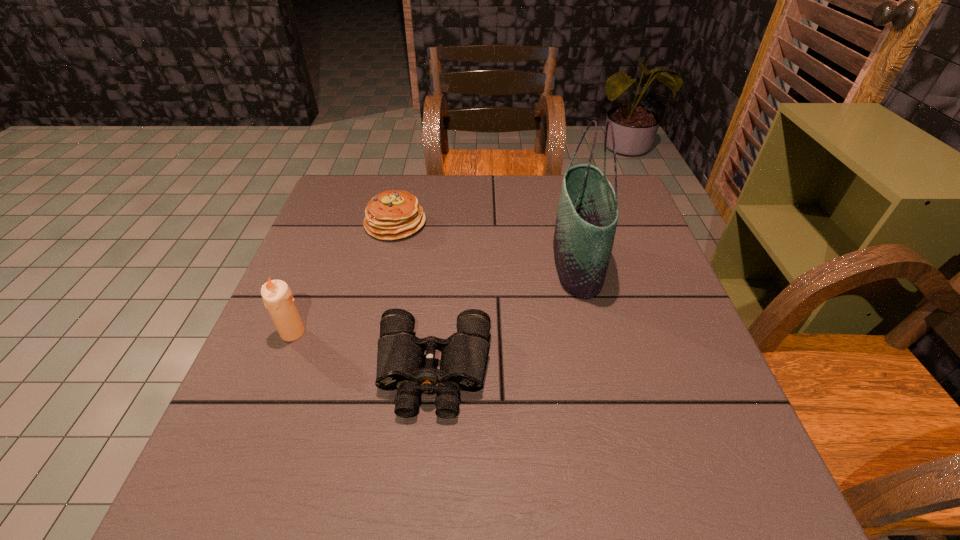
Identify the location of free spot between the rightmost object and the candle. The height and width of the screenshot is (540, 960). (435, 298).

Identify the location of vacant area between the rightmost object and the pancake. This screenshot has height=540, width=960. (486, 244).

Where is `free space between the binoculars and the pancake`? The image size is (960, 540). free space between the binoculars and the pancake is located at coordinates (415, 298).

Where is `unoccupied position between the second tallest object and the binoculars`? unoccupied position between the second tallest object and the binoculars is located at coordinates (363, 352).

Identify the location of empty space between the second tallest object and the binoculars. The width and height of the screenshot is (960, 540). (363, 352).

I want to click on empty location between the leftmost object and the binoculars, so click(x=363, y=352).

This screenshot has width=960, height=540. Identify the location of vacant point located between the leftmost object and the tallest object. (435, 298).

What are the coordinates of `free spot between the pancake and the binoculars` in the screenshot? It's located at (415, 298).

In order to click on free space between the pancake and the binoculars in this screenshot , I will do `click(415, 298)`.

Identify which object is located as the second nearest to the candle. Please provide its 2D coordinates. Your answer should be formatted as a tuple, i.e. [(x, y)], where the tuple contains the x and y coordinates of a point satisfying the conditions above.

[(391, 215)]